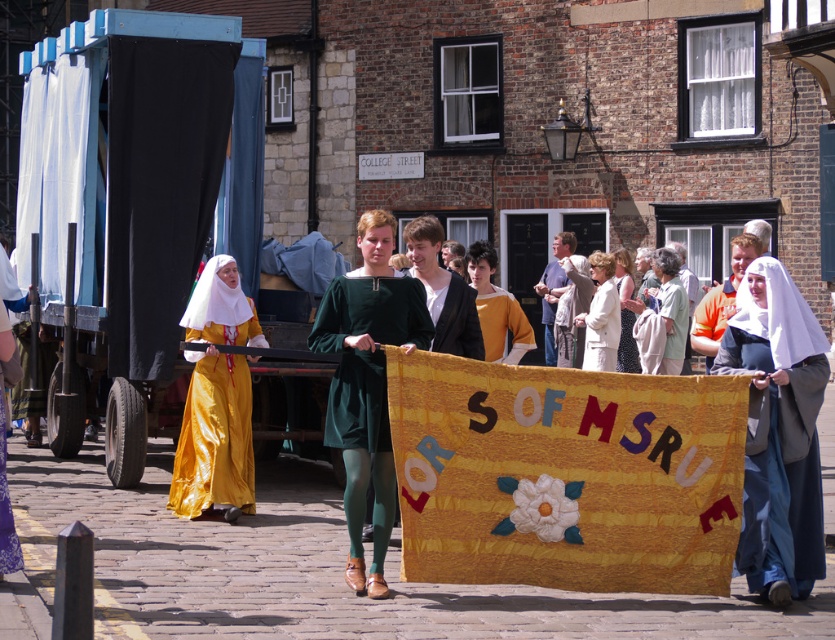
Looking at this image, you are standing on the cobblestone street and see the textured fabric banner at center and the gray woolen robe at right. Which object is closer to the ground?

The textured fabric banner at center is closer to the ground because it is positioned under the gray woolen robe at right.